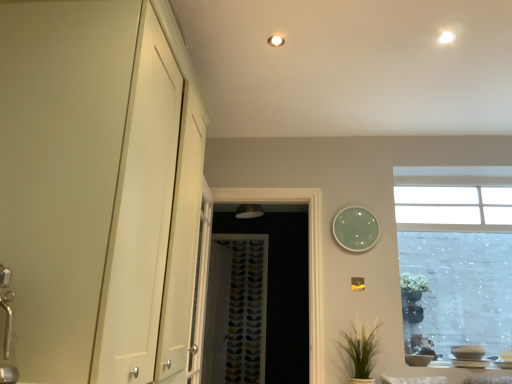
Describe the element at coordinates (246, 309) in the screenshot. I see `multicolored fabric curtain at center` at that location.

You are a GUI agent. You are given a task and a screenshot of the screen. Output one action in this format:
    pyautogui.click(x=<x>, y=<y>)
    Task: Click on the green glass clock at upper right
    The height and width of the screenshot is (384, 512).
    Given the screenshot: What is the action you would take?
    click(355, 229)

Describe the element at coordinates (281, 289) in the screenshot. I see `patterned fabric screen door at center` at that location.

This screenshot has height=384, width=512. Identify the location of white glossy light fixture at upper center, arranged as the 2th lighting when viewed from the right. (275, 41).

How much space does white glossy light fixture at upper right, which is the 1th lighting in front-to-back order, occupy horizontally?

3.50 inches.

You are a GUI agent. You are given a task and a screenshot of the screen. Output one action in this format:
    pyautogui.click(x=<x>, y=<y>)
    Task: Click on the green matte plant at lower right
    Image resolution: width=512 pixels, height=384 pixels.
    Given the screenshot: What is the action you would take?
    pyautogui.click(x=361, y=352)

Locate an element on the screen. The width and height of the screenshot is (512, 384). multicolored fabric curtain at center is located at coordinates (246, 309).

Which object is thinner, green matte plant at lower right or patterned fabric screen door at center?

patterned fabric screen door at center is thinner.

Which object is closer to the camera, green matte plant at lower right or patterned fabric screen door at center?

green matte plant at lower right.

Does green matte plant at lower right appear on the left side of patterned fabric screen door at center?

In fact, green matte plant at lower right is to the right of patterned fabric screen door at center.

Identify the location of screen door to the right of white glossy cabinet at left. The image size is (512, 384). (281, 289).

Is patterned fabric screen door at center next to white glossy cabinet at left?

No, patterned fabric screen door at center is not with white glossy cabinet at left.

Which object is positioned more to the left, patterned fabric screen door at center or white glossy cabinet at left?

From the viewer's perspective, white glossy cabinet at left appears more on the left side.

Is white glossy light fixture at upper right, the 1th lighting from the right, facing towards white glossy cabinet at left?

No, white glossy light fixture at upper right, the 1th lighting from the right, is not facing towards white glossy cabinet at left.

From a real-world perspective, is white glossy light fixture at upper right, which is the 1th lighting in front-to-back order, over white glossy cabinet at left?

Yes.

Considering the positions of points (454, 39) and (104, 332), is point (454, 39) closer to camera compared to point (104, 332)?

No, (454, 39) is further to viewer.

Considering the sizes of objects white glossy light fixture at upper right, the 1th lighting from the right, and white glossy cabinet at left in the image provided, who is wider, white glossy light fixture at upper right, the 1th lighting from the right, or white glossy cabinet at left?

white glossy cabinet at left.

Is point (439, 40) more distant than point (362, 210)?

No, (439, 40) is in front of (362, 210).

Is white glossy light fixture at upper right, acting as the second lighting starting from the left, turned away from green glass clock at upper right?

That's not correct — white glossy light fixture at upper right, acting as the second lighting starting from the left, is not looking away from green glass clock at upper right.

Does white glossy light fixture at upper right, the 1th lighting from the right, have a smaller size compared to green glass clock at upper right?

Yes.

From the image's perspective, is white glossy cabinet at left above or below white glossy light fixture at upper right, arranged as the second lighting when viewed from the back?

Clearly, from the image's perspective, white glossy cabinet at left is below white glossy light fixture at upper right, arranged as the second lighting when viewed from the back.

Considering the positions of objects white glossy cabinet at left and white glossy light fixture at upper right, which is the 1th lighting in front-to-back order, in the image provided, who is more to the left, white glossy cabinet at left or white glossy light fixture at upper right, which is the 1th lighting in front-to-back order,?

white glossy cabinet at left is more to the left.

How distant is white glossy cabinet at left from white glossy light fixture at upper right, which is the 1th lighting in front-to-back order?

A distance of 1.76 meters exists between white glossy cabinet at left and white glossy light fixture at upper right, which is the 1th lighting in front-to-back order.

Does white glossy cabinet at left have a smaller size compared to white glossy light fixture at upper right, the 1th lighting from the right?

Actually, white glossy cabinet at left might be larger than white glossy light fixture at upper right, the 1th lighting from the right.

Is white glossy cabinet at left touching green matte plant at lower right?

No.

Is white glossy cabinet at left at the left side of green matte plant at lower right?

Correct, you'll find white glossy cabinet at left to the left of green matte plant at lower right.

Considering the relative sizes of white glossy cabinet at left and green matte plant at lower right in the image provided, is white glossy cabinet at left smaller than green matte plant at lower right?

No.

Based on the photo, is green matte plant at lower right a part of white glossy cabinet at left?

No.

Which is more to the left, multicolored fabric curtain at center or white glossy light fixture at upper center, the first lighting from the back?

multicolored fabric curtain at center is more to the left.

Does multicolored fabric curtain at center come in front of white glossy light fixture at upper center, placed as the second lighting when sorted from front to back?

No, multicolored fabric curtain at center is behind white glossy light fixture at upper center, placed as the second lighting when sorted from front to back.

Is multicolored fabric curtain at center taller than white glossy light fixture at upper center, positioned as the 1th lighting in left-to-right order?

Yes.

Does point (253, 270) come farther from viewer compared to point (284, 41)?

Yes.

Where is `screen door on the left of green matte plant at lower right`? The image size is (512, 384). screen door on the left of green matte plant at lower right is located at coordinates (281, 289).

Identify the location of screen door that appears below the white glossy cabinet at left (from a real-world perspective). (281, 289).

Based on their spatial positions, is white glossy cabinet at left or green matte plant at lower right further from multicolored fabric curtain at center?

white glossy cabinet at left is positioned further to the anchor multicolored fabric curtain at center.

Considering their positions, is white glossy light fixture at upper center, positioned as the 1th lighting in left-to-right order, positioned further to white glossy cabinet at left than green glass clock at upper right?

green glass clock at upper right is further to white glossy cabinet at left.

In the scene shown: When comparing their distances from white glossy cabinet at left, does multicolored fabric curtain at center or white glossy light fixture at upper center, placed as the second lighting when sorted from front to back, seem closer?

white glossy light fixture at upper center, placed as the second lighting when sorted from front to back.

Which object lies further to the anchor point white glossy cabinet at left, patterned fabric screen door at center or white glossy light fixture at upper right, the 1th lighting from the right?

patterned fabric screen door at center is positioned further to the anchor white glossy cabinet at left.

From the picture: Which object lies nearer to the anchor point multicolored fabric curtain at center, white glossy light fixture at upper right, arranged as the second lighting when viewed from the back, or patterned fabric screen door at center?

The object closer to multicolored fabric curtain at center is patterned fabric screen door at center.

Based on their spatial positions, is white glossy light fixture at upper center, arranged as the 2th lighting when viewed from the right, or multicolored fabric curtain at center further from white glossy light fixture at upper right, which is the 1th lighting in front-to-back order?

multicolored fabric curtain at center is positioned further to the anchor white glossy light fixture at upper right, which is the 1th lighting in front-to-back order.

From the image, which object appears to be farther from green glass clock at upper right, green matte plant at lower right or multicolored fabric curtain at center?

multicolored fabric curtain at center is further to green glass clock at upper right.

When comparing their distances from patterned fabric screen door at center, does green glass clock at upper right or white glossy light fixture at upper right, acting as the second lighting starting from the left, seem further?

white glossy light fixture at upper right, acting as the second lighting starting from the left, lies further to patterned fabric screen door at center than the other object.

Where is `clock between white glossy light fixture at upper right, acting as the second lighting starting from the left, and multicolored fabric curtain at center from front to back`? clock between white glossy light fixture at upper right, acting as the second lighting starting from the left, and multicolored fabric curtain at center from front to back is located at coordinates (355, 229).

Where is `clock between white glossy light fixture at upper right, arranged as the second lighting when viewed from the back, and patterned fabric screen door at center vertically`? clock between white glossy light fixture at upper right, arranged as the second lighting when viewed from the back, and patterned fabric screen door at center vertically is located at coordinates click(355, 229).

Identify the location of lighting between white glossy light fixture at upper right, which is the 1th lighting in front-to-back order, and multicolored fabric curtain at center, along the z-axis. pos(275,41).

I want to click on clock between white glossy light fixture at upper right, the 1th lighting from the right, and green matte plant at lower right vertically, so click(355, 229).